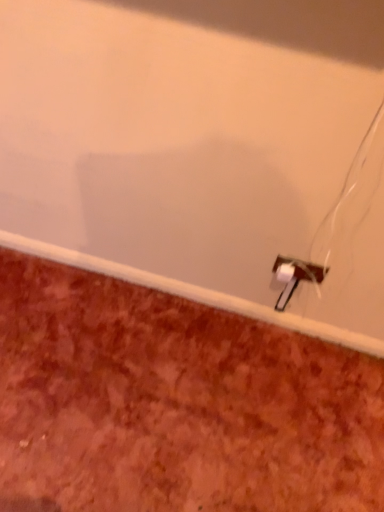
Locate an element on the screen. white plastic power plug at lower right is located at coordinates (295, 277).

What do you see at coordinates (295, 277) in the screenshot? I see `white plastic power plug at lower right` at bounding box center [295, 277].

The height and width of the screenshot is (512, 384). Find the location of `white plastic power plug at lower right`. white plastic power plug at lower right is located at coordinates (295, 277).